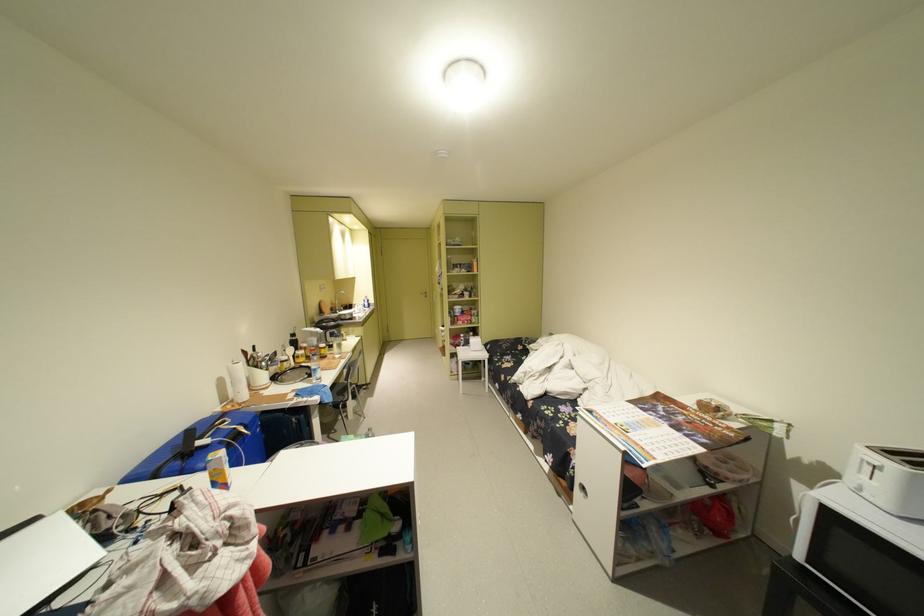
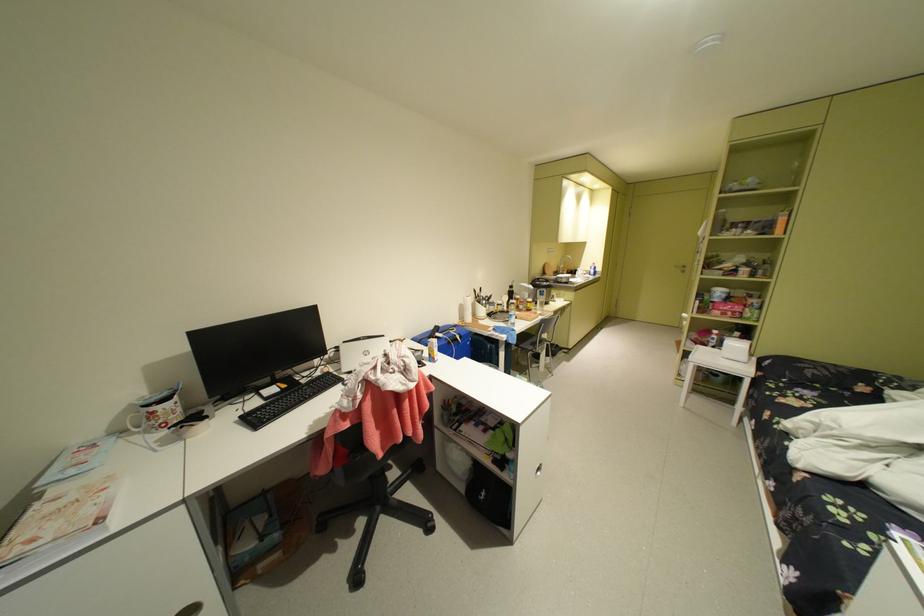
Where in the second image is the point corresponding to point (476, 315) from the first image?

(740, 304)